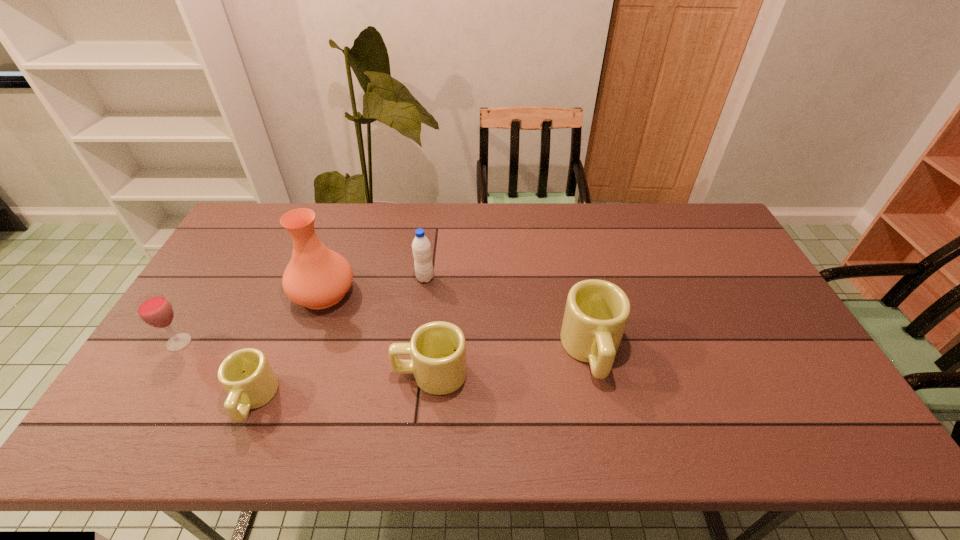
This screenshot has width=960, height=540. Find the location of `object that is the fourth closest one to the shortest object`. object that is the fourth closest one to the shortest object is located at coordinates (421, 247).

Where is `mug that is the closest to the tallest mug`? The height and width of the screenshot is (540, 960). mug that is the closest to the tallest mug is located at coordinates point(438,349).

Select which mug appears as the second closest to the vase. Please provide its 2D coordinates. Your answer should be formatted as a tuple, i.e. [(x, y)], where the tuple contains the x and y coordinates of a point satisfying the conditions above.

[(438, 349)]

Find the location of a particular element. This screenshot has height=540, width=960. blank space that satisfies the following two spatial constraints: 1. with the handle on the side of the second mug from left to right; 2. with the handle on the side of the leftmost mug is located at coordinates (427, 399).

Identify the location of vacant position in the image that satisfies the following two spatial constraints: 1. on the back side of the water bottle; 2. on the right side of the leftmost object. The height and width of the screenshot is (540, 960). (219, 278).

You are a GUI agent. You are given a task and a screenshot of the screen. Output one action in this format:
    pyautogui.click(x=<x>, y=<y>)
    Task: Click on the free region that satisfies the following two spatial constraints: 1. on the back side of the vase; 2. on the right side of the water bottle
    The height and width of the screenshot is (540, 960).
    Given the screenshot: What is the action you would take?
    pyautogui.click(x=328, y=278)